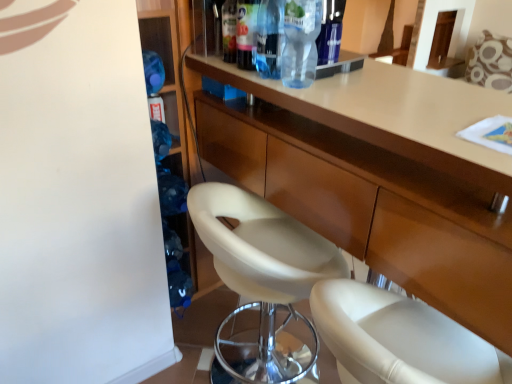
Where is `vacant space to the right of transparent plastic bottle at upper center, the 4th bottle from the left`? vacant space to the right of transparent plastic bottle at upper center, the 4th bottle from the left is located at coordinates (354, 84).